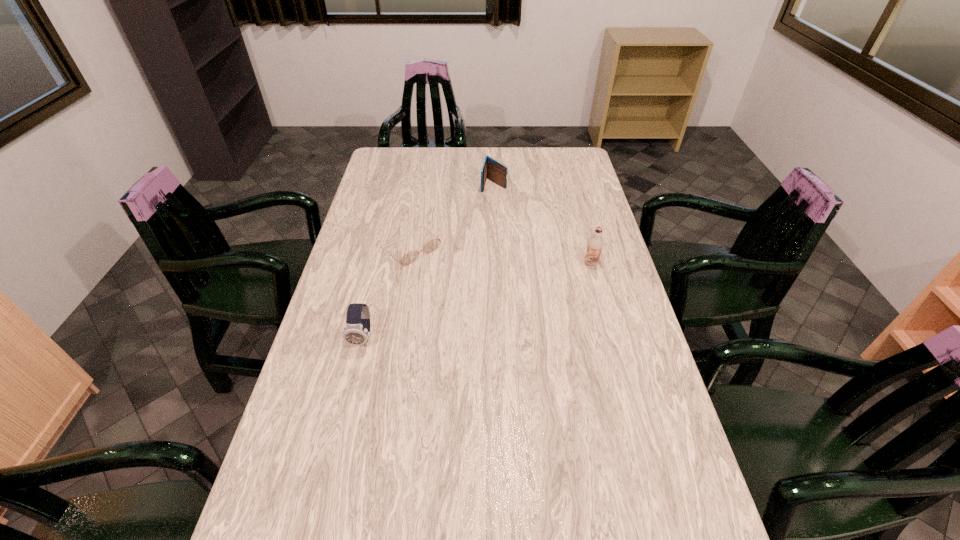
Find the location of a particular element. The height and width of the screenshot is (540, 960). vacant area at the right edge is located at coordinates (590, 188).

The image size is (960, 540). In the image, there is a desktop. Find the location of `free space at the far left corner`. free space at the far left corner is located at coordinates (413, 157).

At what (x,y) coordinates should I click in order to perform the action: click on vacant space at the near left corner of the desktop. Please return your answer as a coordinate pair (x, y). This screenshot has height=540, width=960. Looking at the image, I should click on (310, 513).

At what (x,y) coordinates should I click in order to perform the action: click on blank region between the wallet and the chocolate milk. Please return your answer as a coordinate pair (x, y). The height and width of the screenshot is (540, 960). Looking at the image, I should click on (542, 224).

This screenshot has height=540, width=960. What are the coordinates of `vacant space that's between the sunglasses and the chocolate milk` in the screenshot? It's located at (501, 256).

Locate an element on the screen. vacant space that is in between the sunglasses and the farthest object is located at coordinates (452, 217).

The image size is (960, 540). Find the location of `free space that is in between the watch and the shortest object`. free space that is in between the watch and the shortest object is located at coordinates (387, 293).

Find the location of `vacant area between the third object from left to right and the chocolate milk`. vacant area between the third object from left to right and the chocolate milk is located at coordinates (542, 224).

At what (x,y) coordinates should I click in order to perform the action: click on free space between the watch and the farthest object. Please return your answer as a coordinate pair (x, y). This screenshot has height=540, width=960. Looking at the image, I should click on (428, 261).

What are the coordinates of `empty location between the sunglasses and the tallest object` in the screenshot? It's located at (501, 256).